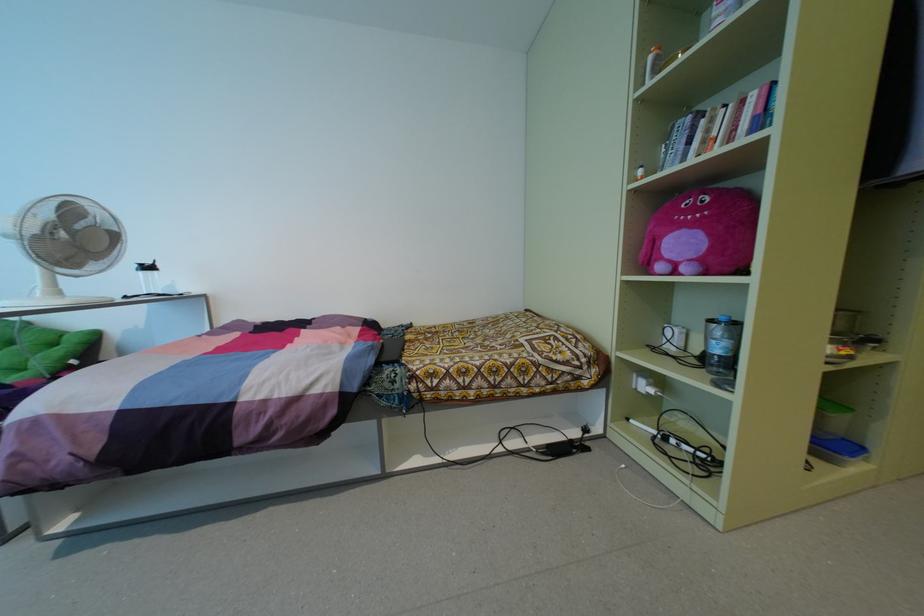
Where would you lift the clear water bottle? Please return your answer as a coordinate pair (x, y).

(150, 281)